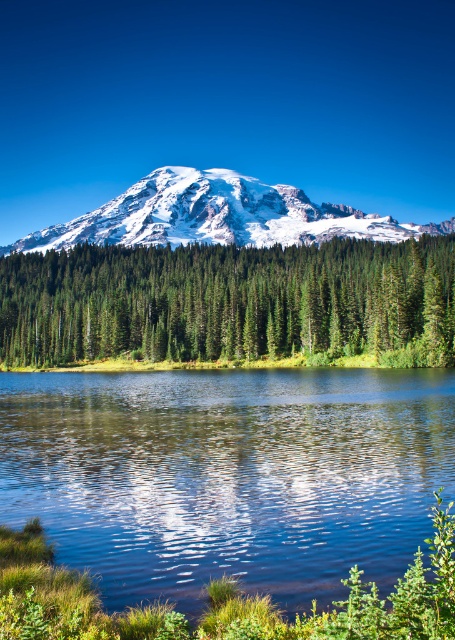
Question: Among these objects, which one is nearest to the camera?

Choices:
 (A) green matte tree at center
 (B) clear water at center
 (C) snowy white mountain at upper center

Answer: (B)

Question: In this image, where is green matte tree at center located relative to snowy white mountain at upper center?

Choices:
 (A) above
 (B) below

Answer: (B)

Question: Among these points, which one is farthest from the camera?

Choices:
 (A) (303, 216)
 (B) (338, 444)
 (C) (120, 298)

Answer: (A)

Question: Does green matte tree at center appear on the right side of snowy white mountain at upper center?

Choices:
 (A) no
 (B) yes

Answer: (A)

Question: Is clear water at center positioned before green matte tree at center?

Choices:
 (A) no
 (B) yes

Answer: (B)

Question: Which of the following is the farthest from the observer?

Choices:
 (A) snowy white mountain at upper center
 (B) green matte tree at center
 (C) clear water at center

Answer: (A)